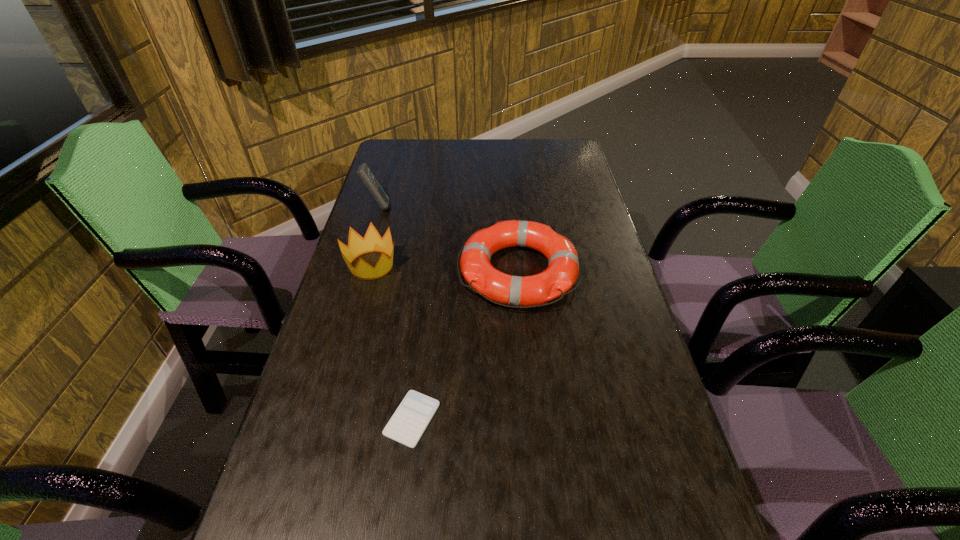
Find the location of a particular element. the farthest object is located at coordinates (364, 173).

You are a GUI agent. You are given a task and a screenshot of the screen. Output one action in this format:
    pyautogui.click(x=<x>, y=<y>)
    Task: Click on the taller calculator
    
    Given the screenshot: What is the action you would take?
    pyautogui.click(x=364, y=173)

Image resolution: width=960 pixels, height=540 pixels. What are the coordinates of `crown` in the screenshot? It's located at (372, 242).

The image size is (960, 540). What are the coordinates of `the rightmost object` in the screenshot? It's located at (563, 267).

Image resolution: width=960 pixels, height=540 pixels. Identify the location of the second shortest object. (563, 267).

This screenshot has width=960, height=540. What are the coordinates of `the nearest object` in the screenshot? It's located at (408, 423).

Identify the location of the right calculator. The height and width of the screenshot is (540, 960). (408, 423).

Image resolution: width=960 pixels, height=540 pixels. Find the location of `free space located on the front-facing side of the tallest object`. free space located on the front-facing side of the tallest object is located at coordinates (427, 206).

Where is `vacant space situated 0.200m on the right of the crown`? This screenshot has height=540, width=960. vacant space situated 0.200m on the right of the crown is located at coordinates (470, 265).

You are a GUI agent. You are given a task and a screenshot of the screen. Output one action in this format:
    pyautogui.click(x=<x>, y=<y>)
    Task: Click on the vacant area located on the front of the rightmost object
    The image size is (960, 540).
    Given the screenshot: What is the action you would take?
    pyautogui.click(x=525, y=331)